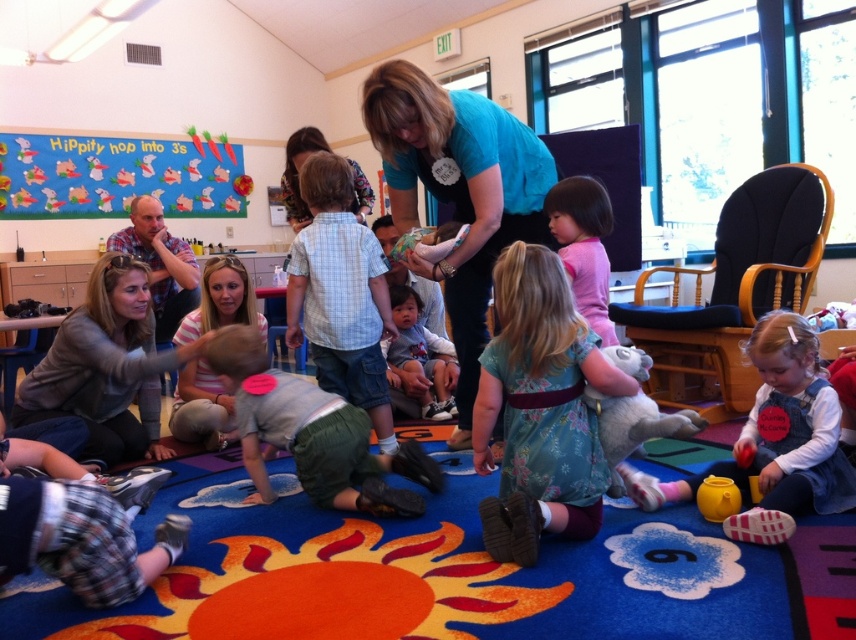
Who is taller, floral fabric dress at center or fluffy plush koala at lower center?

floral fabric dress at center

Can you confirm if floral fabric dress at center is taller than fluffy plush koala at lower center?

Yes, floral fabric dress at center is taller than fluffy plush koala at lower center.

Which is in front, point (501, 522) or point (590, 406)?

Point (501, 522)

Find the location of a particular element. The image size is (856, 640). floral fabric dress at center is located at coordinates (539, 410).

Is blue cotton shirt at center below fluffy plush koala at lower center?

No.

What do you see at coordinates (458, 193) in the screenshot?
I see `blue cotton shirt at center` at bounding box center [458, 193].

This screenshot has width=856, height=640. What do you see at coordinates (458, 193) in the screenshot?
I see `blue cotton shirt at center` at bounding box center [458, 193].

Where is `blue cotton shirt at center`? blue cotton shirt at center is located at coordinates (458, 193).

Is gray cotton shirt at center smaller than fluffy plush koala at lower center?

Incorrect, gray cotton shirt at center is not smaller in size than fluffy plush koala at lower center.

The width and height of the screenshot is (856, 640). What do you see at coordinates (311, 433) in the screenshot?
I see `gray cotton shirt at center` at bounding box center [311, 433].

Is point (317, 442) in front of point (613, 451)?

That is False.

The image size is (856, 640). In order to click on gray cotton shirt at center in this screenshot , I will do `click(311, 433)`.